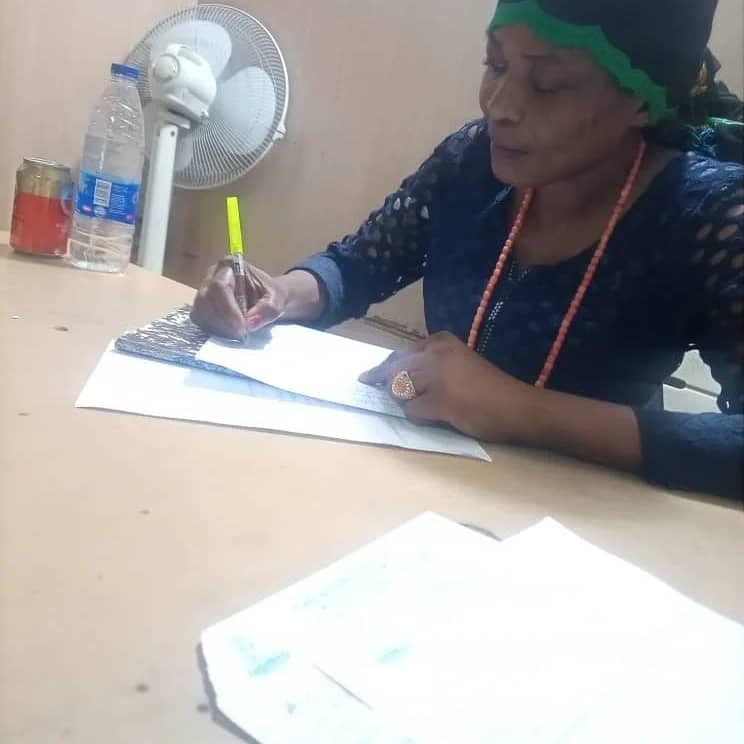
You are a GUI agent. You are given a task and a screenshot of the screen. Output one action in this format:
    pyautogui.click(x=<x>, y=<y>)
    Task: Click on the fan blade
    
    Given the screenshot: What is the action you would take?
    pyautogui.click(x=234, y=115), pyautogui.click(x=170, y=150), pyautogui.click(x=214, y=54)